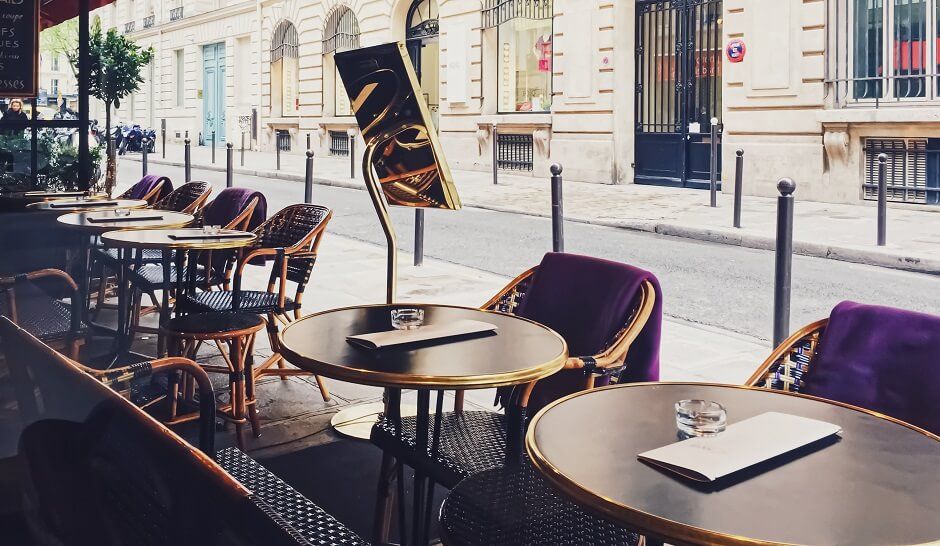
Locate an element on the screen. This screenshot has height=546, width=940. chairs is located at coordinates (143, 188), (176, 203), (223, 216), (277, 232), (517, 301), (799, 362), (51, 324), (271, 482).